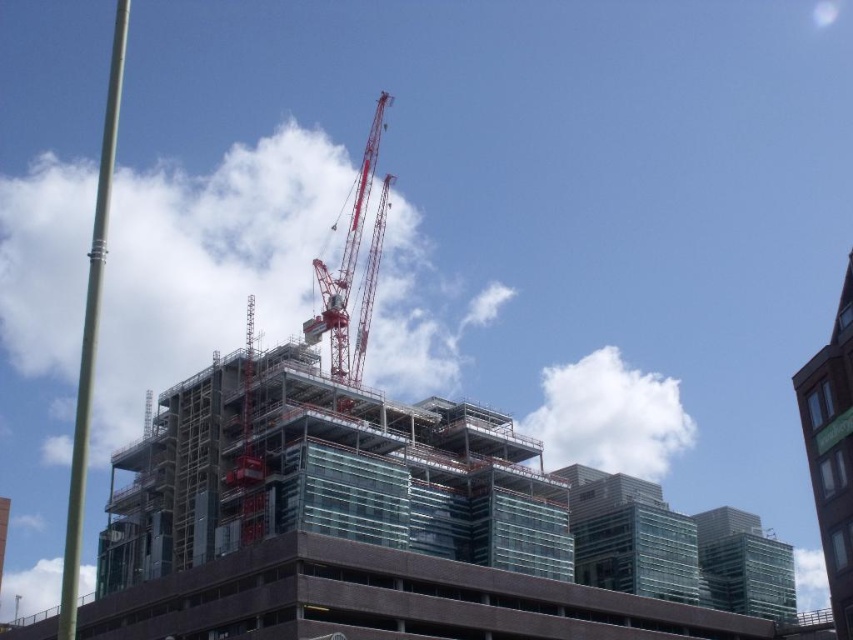
Question: Is brown brick building at upper right above red metallic crane at center?

Choices:
 (A) yes
 (B) no

Answer: (B)

Question: Can you confirm if brown brick building at upper right is positioned to the left of red metallic crane at center?

Choices:
 (A) no
 (B) yes

Answer: (A)

Question: Which point is farther from the camera taking this photo?

Choices:
 (A) (369, 259)
 (B) (848, 301)

Answer: (A)

Question: Considering the relative positions of brown brick building at upper right and red metallic crane at center in the image provided, where is brown brick building at upper right located with respect to red metallic crane at center?

Choices:
 (A) left
 (B) right

Answer: (B)

Question: Which object is closer to the camera taking this photo?

Choices:
 (A) brown brick building at upper right
 (B) red metallic crane at center

Answer: (A)